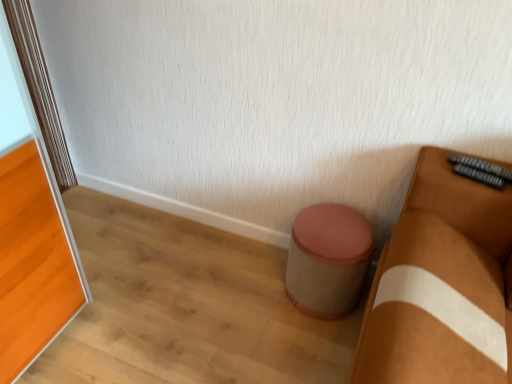
Question: Should I look upward or downward to see orange glossy screen door at left?

Choices:
 (A) down
 (B) up

Answer: (A)

Question: Is orange glossy screen door at left facing towards beige fabric stool at center?

Choices:
 (A) no
 (B) yes

Answer: (A)

Question: Considering the relative sizes of orange glossy screen door at left and beige fabric stool at center in the image provided, is orange glossy screen door at left taller than beige fabric stool at center?

Choices:
 (A) no
 (B) yes

Answer: (B)

Question: Is orange glossy screen door at left looking in the opposite direction of beige fabric stool at center?

Choices:
 (A) yes
 (B) no

Answer: (B)

Question: From the image's perspective, does orange glossy screen door at left appear higher than beige fabric stool at center?

Choices:
 (A) yes
 (B) no

Answer: (A)

Question: From a real-world perspective, is orange glossy screen door at left below beige fabric stool at center?

Choices:
 (A) no
 (B) yes

Answer: (A)

Question: Is the depth of orange glossy screen door at left less than that of beige fabric stool at center?

Choices:
 (A) no
 (B) yes

Answer: (B)

Question: Is beige fabric stool at center in contact with orange glossy screen door at left?

Choices:
 (A) no
 (B) yes

Answer: (A)

Question: Can you confirm if beige fabric stool at center is shorter than orange glossy screen door at left?

Choices:
 (A) yes
 (B) no

Answer: (A)

Question: Does beige fabric stool at center have a greater width compared to orange glossy screen door at left?

Choices:
 (A) no
 (B) yes

Answer: (B)

Question: From a real-world perspective, is beige fabric stool at center positioned over orange glossy screen door at left based on gravity?

Choices:
 (A) no
 (B) yes

Answer: (A)

Question: Is orange glossy screen door at left at the back of beige fabric stool at center?

Choices:
 (A) no
 (B) yes

Answer: (A)

Question: Is beige fabric stool at center not inside orange glossy screen door at left?

Choices:
 (A) no
 (B) yes

Answer: (B)

Question: In terms of width, does beige fabric stool at center look wider or thinner when compared to orange glossy screen door at left?

Choices:
 (A) thin
 (B) wide

Answer: (B)